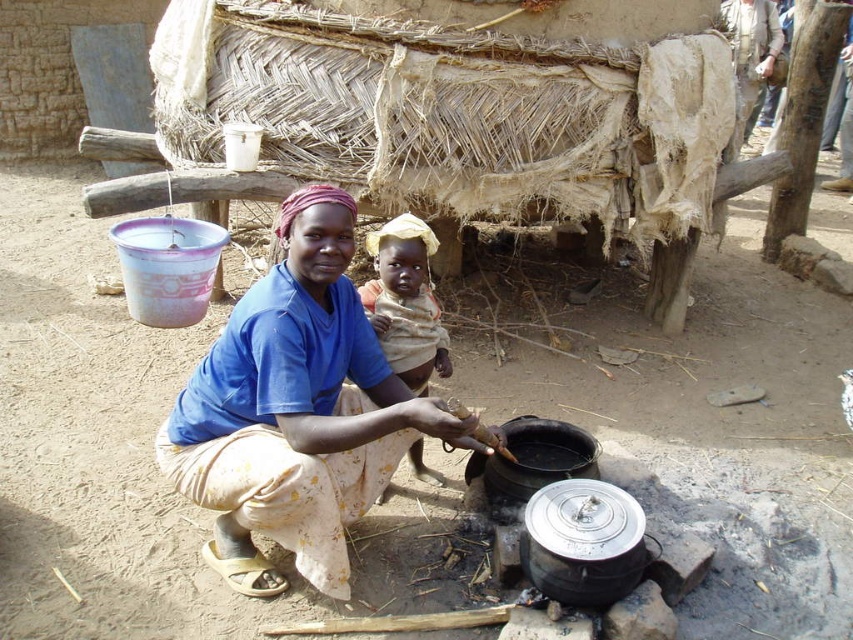
What is the color of the fabric located at the coordinates point (296, 412)?

The blue fabric at center is located at point (296, 412), so the color is blue.

You are a photographer standing 2 meters away from the blue fabric at center and the light brown fabric baby at center. You want to take a photo that includes both of them in the frame. Given their distance apart, is it possible to capture both in a single shot without moving your position?

The blue fabric at center and light brown fabric baby at center are 54.21 centimeters apart, so yes, it is possible to capture both in a single shot without moving your position since the distance between them is relatively small and within the camera frame at that distance.